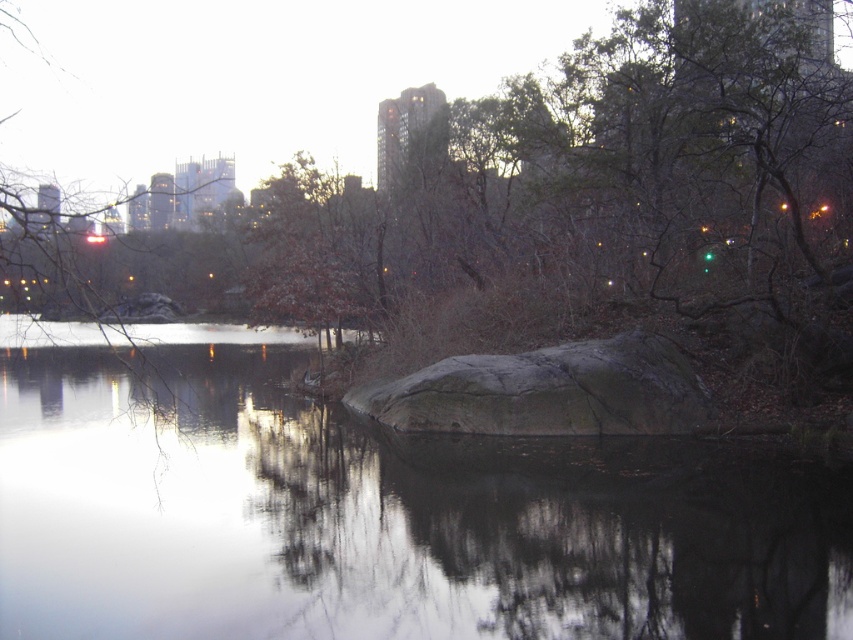
You are standing at the edge of the park pond and see the smooth dark water at center and the gray rough rock at center. Which object is nearer to you?

The smooth dark water at center is closer to the viewer than the gray rough rock at center.

You are a park visitor who wants to cross the pond. You see the smooth dark water at center and the gray rough rock at center. Which one is a better path to step on?

The gray rough rock at center is a better path to step on because the smooth dark water at center is above it, implying the rock is submerged but still offers a firmer footing compared to the water.